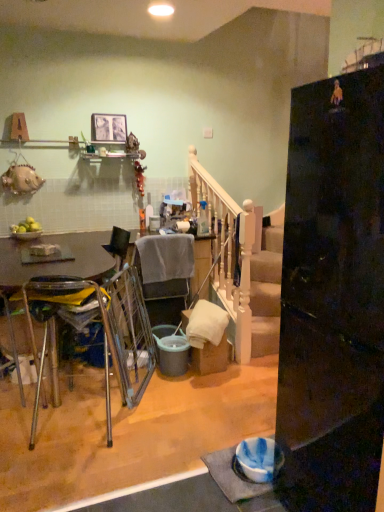
Find the location of a particular element. Image resolution: width=384 pixels, height=512 pixels. free space in front of metallic silver chair at left, which is counted as the first chair, starting from the left is located at coordinates (74, 479).